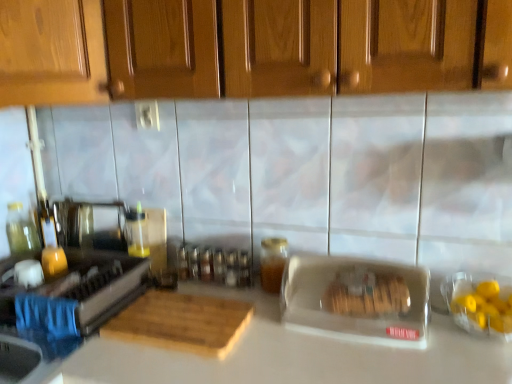
The image size is (512, 384). Find the location of `free spot above wooden cutting board at center (from a real-world perspective)`. free spot above wooden cutting board at center (from a real-world perspective) is located at coordinates (178, 304).